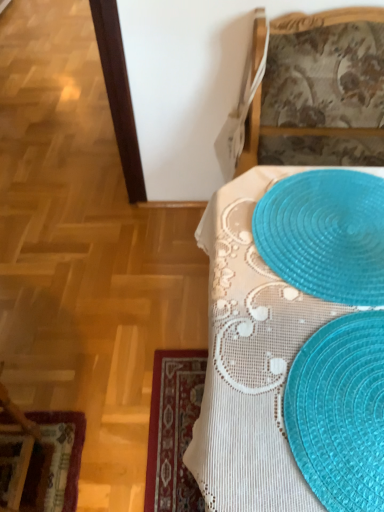
Question: Considering the positions of translucent plastic placemat at upper right and velvet burgundy placemat at lower left in the image, is translucent plastic placemat at upper right taller or shorter than velvet burgundy placemat at lower left?

Choices:
 (A) tall
 (B) short

Answer: (A)

Question: Based on their sizes in the image, would you say translucent plastic placemat at upper right is bigger or smaller than velvet burgundy placemat at lower left?

Choices:
 (A) small
 (B) big

Answer: (B)

Question: Which is nearer to the translucent blue placemat at lower right?

Choices:
 (A) translucent plastic placemat at upper right
 (B) translucent plastic placemat at upper right
 (C) velvet burgundy placemat at lower left
 (D) translucent plastic placemats at lower right

Answer: (D)

Question: Based on their relative distances, which object is nearer to the velvet burgundy placemat at lower left?

Choices:
 (A) translucent plastic placemat at upper right
 (B) translucent plastic placemat at upper right
 (C) translucent blue placemat at lower right
 (D) translucent plastic placemats at lower right

Answer: (D)